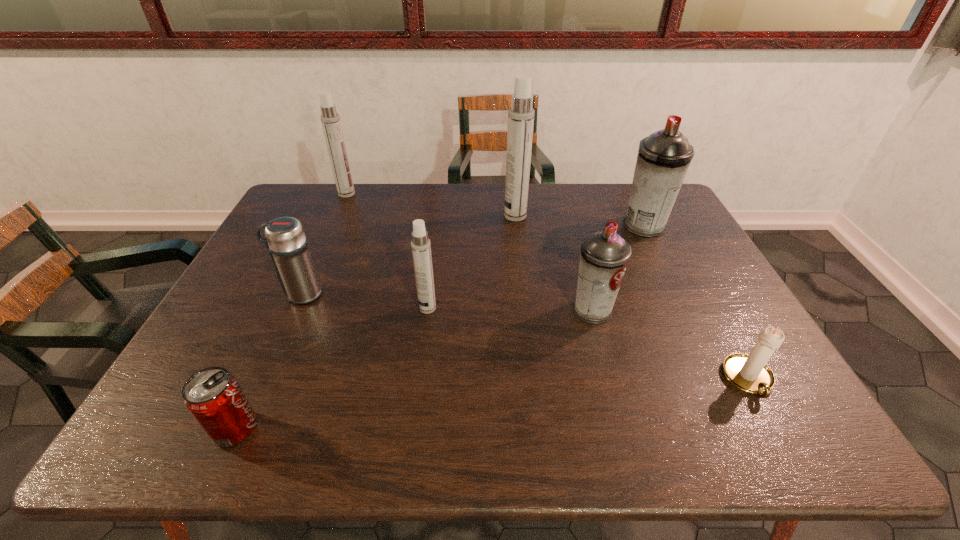
Locate an element on the screen. The image size is (960, 540). the tallest object is located at coordinates (521, 114).

Identify the location of the second farthest white aerosol can. (521, 114).

The width and height of the screenshot is (960, 540). Identify the location of the farthest aerosol can. (330, 119).

Where is `the leftmost white aerosol can`? The height and width of the screenshot is (540, 960). the leftmost white aerosol can is located at coordinates (330, 119).

Locate an element on the screen. The image size is (960, 540). the right gray aerosol can is located at coordinates (663, 159).

Locate an element on the screen. The height and width of the screenshot is (540, 960). the farther gray aerosol can is located at coordinates (663, 159).

Locate an element on the screen. the second aerosol can from left to right is located at coordinates click(x=421, y=247).

Image resolution: width=960 pixels, height=540 pixels. In order to click on the fifth object from right to left in this screenshot , I will do `click(421, 247)`.

At what (x,y) coordinates should I click in order to perform the action: click on the fourth aerosol can from left to right. Please return your answer as a coordinate pair (x, y). Looking at the image, I should click on (604, 257).

Where is `the nearer gray aerosol can`? The width and height of the screenshot is (960, 540). the nearer gray aerosol can is located at coordinates (604, 257).